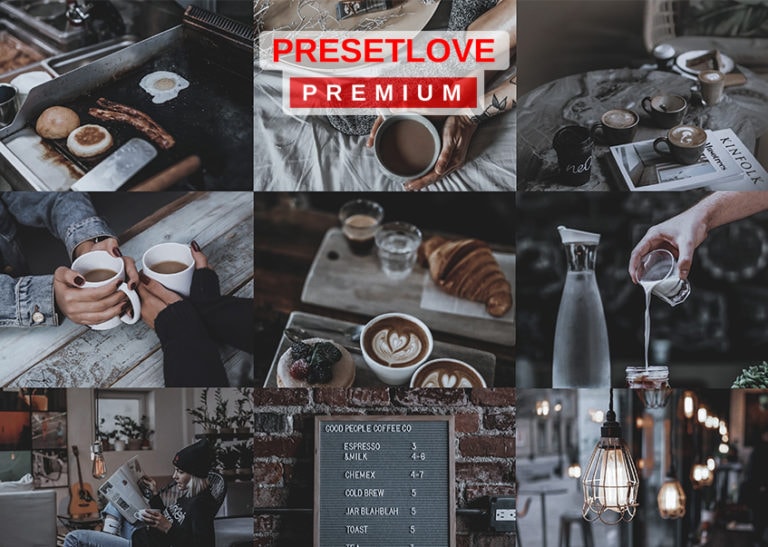
The height and width of the screenshot is (547, 768). What are the coordinates of `cup` in the screenshot? It's located at (392, 369), (409, 382), (131, 305), (180, 283), (623, 133), (686, 153), (669, 122), (709, 95), (435, 144).